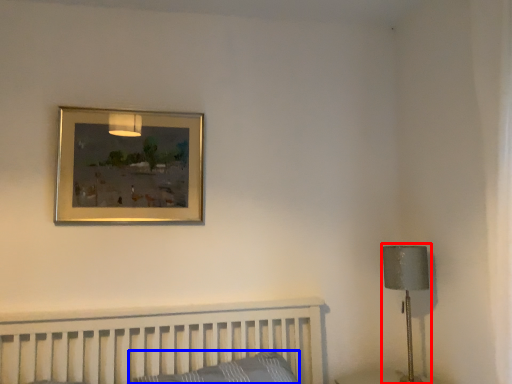
Question: Which point is closer to the camera, table lamp (highlighted by a red box) or pillow (highlighted by a blue box)?

Choices:
 (A) table lamp
 (B) pillow

Answer: (B)